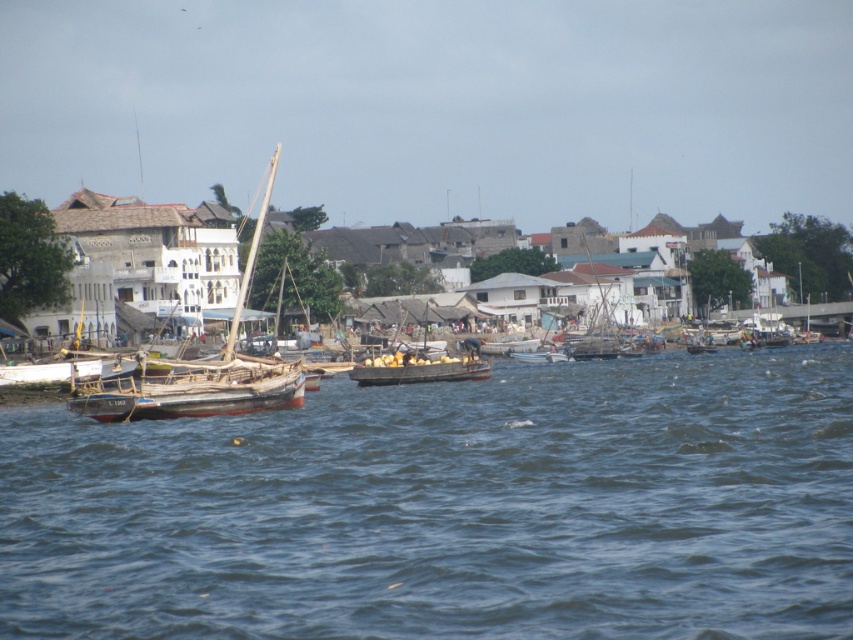
You are standing at the origin point in the image. Which direction should you move to reach the blue water at center?

The blue water at center is located at point 0.795 on the x axis and 0.529 on the y axis. Since the origin is at the bottom left corner of the image, moving towards the right and slightly upwards would reach the blue water at center.

You are a tourist standing on the dock and see the blue water at center and the wooden sailboat at left. Which object is closer to you?

The wooden sailboat at left is closer to you because the blue water at center is positioned under it, indicating it is further away.

From the picture: You are a tourist standing on the dock and want to take a photo of both the wooden sailboat at left and the wooden boat at center. Which boat should you position yourself closer to in order to include both in the frame without cropping either?

You should position yourself closer to the wooden boat at center since the wooden sailboat at left is taller than the wooden boat at center, so by moving closer to the shorter boat, you can ensure both fit within the camera frame.